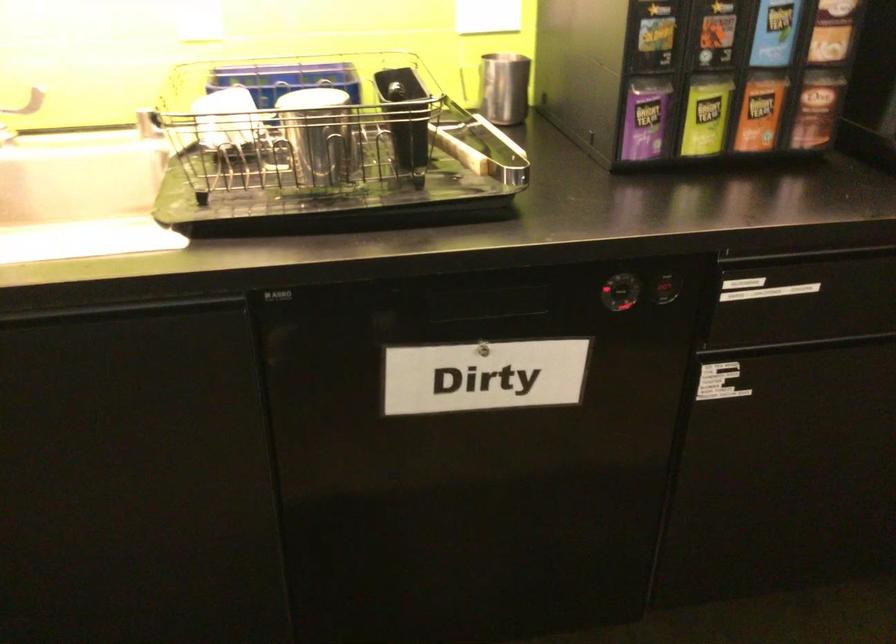
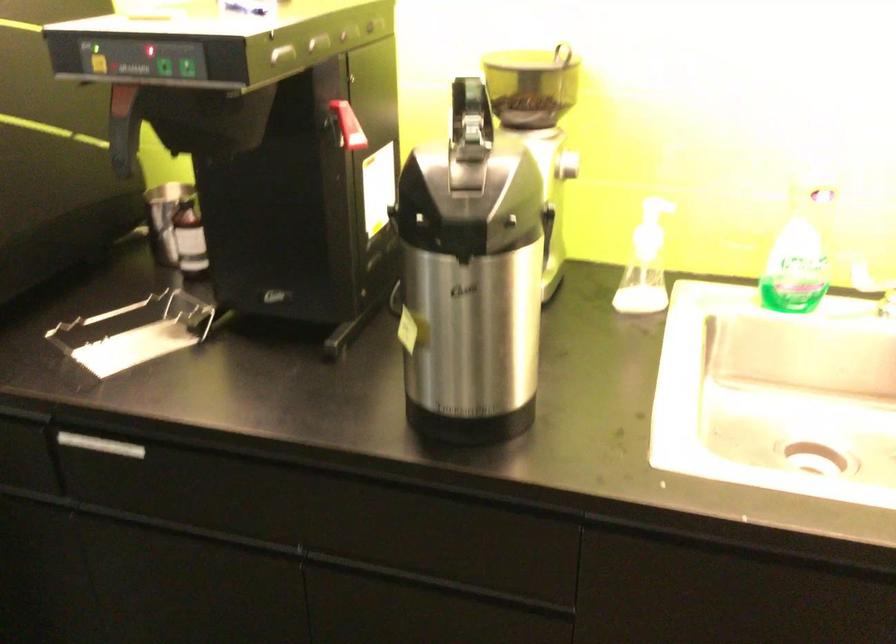
Question: Which direction would the cameraman need to move to produce the second image? Reply with the corresponding letter.

Choices:
 (A) Left
 (B) Right
 (C) Forward
 (D) Backward

Answer: (A)